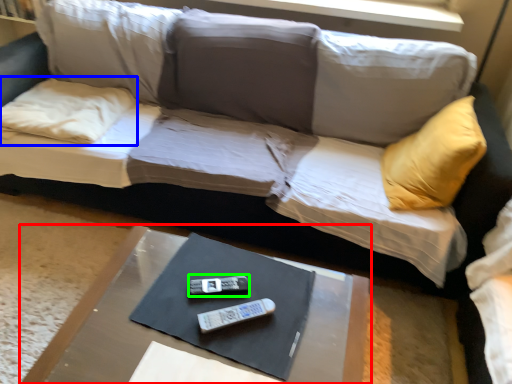
Question: Which object is positioned farthest from table (highlighted by a red box)? Select from pillow (highlighted by a blue box) and remote (highlighted by a green box).

Choices:
 (A) pillow
 (B) remote

Answer: (A)